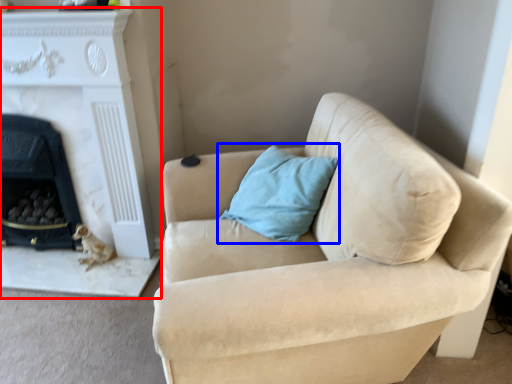
Question: Among these objects, which one is farthest to the camera, fireplace (highlighted by a red box) or pillow (highlighted by a blue box)?

Choices:
 (A) fireplace
 (B) pillow

Answer: (A)